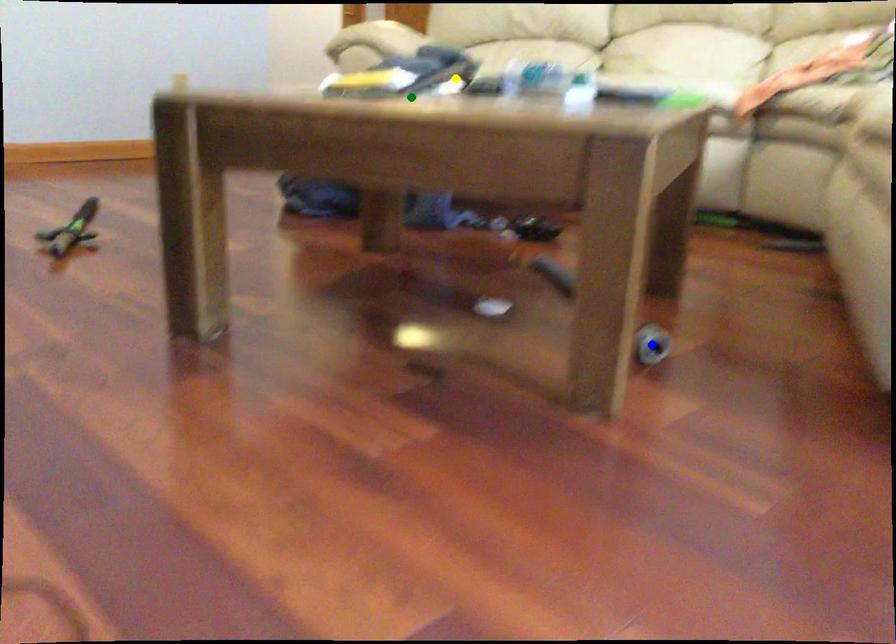
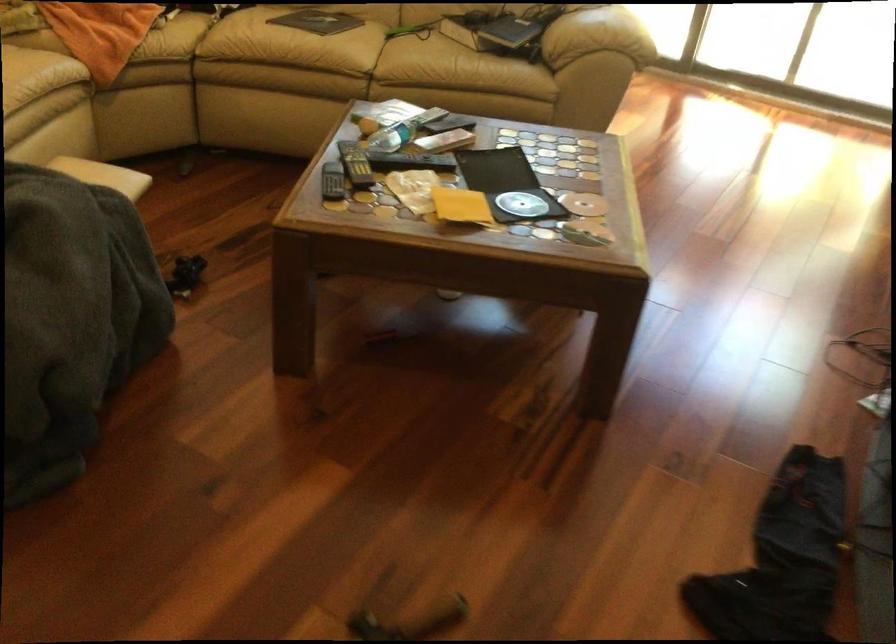
I am providing you with two images of the same scene from different viewpoints. Three points are marked in image1. Which point corresponds to a part or object that is occluded in image2?In image1, three points are marked. Which of them correspond to a part or object that is occluded in image2?Among the three points shown in image1, which one corresponds to a part or object that is no longer visible due to occlusion in image2?

blue point cannot be seen in image2.